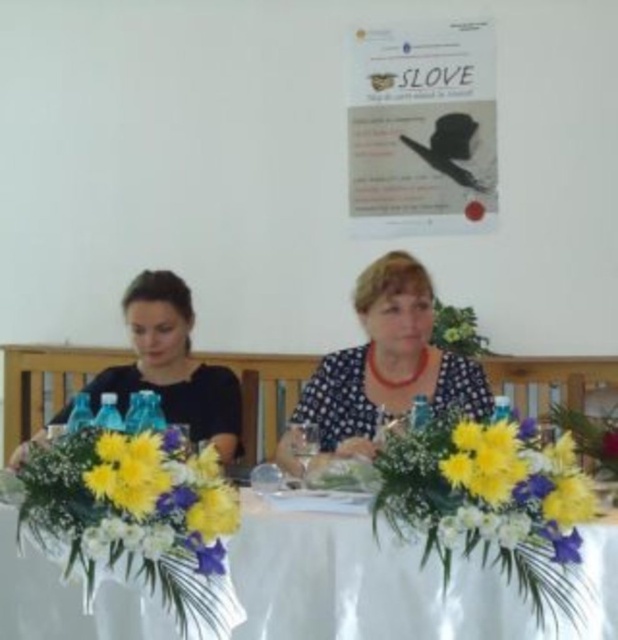
Does white cloth table at center come behind white floral arrangement at center?

Yes, white cloth table at center is behind white floral arrangement at center.

Does white cloth table at center have a greater width compared to white floral arrangement at center?

Indeed, white cloth table at center has a greater width compared to white floral arrangement at center.

Where is `white cloth table at center`? white cloth table at center is located at coordinates (360, 586).

Does point (104, 458) lie in front of point (184, 394)?

Yes, point (104, 458) is closer to viewer.

Is white floral arrangement at center bigger than matte black dress at left?

Actually, white floral arrangement at center might be smaller than matte black dress at left.

Identify the location of white floral arrangement at center. The height and width of the screenshot is (640, 618). (129, 492).

Is yellow fabric flower bouquet at center further to the viewer compared to matte black dress at left?

No, yellow fabric flower bouquet at center is closer to the viewer.

Does yellow fabric flower bouquet at center appear on the right side of matte black dress at left?

Indeed, yellow fabric flower bouquet at center is positioned on the right side of matte black dress at left.

This screenshot has height=640, width=618. What are the coordinates of `yellow fabric flower bouquet at center` in the screenshot? It's located at (489, 500).